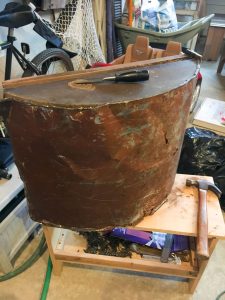
Locate an element on the screen. Image resolution: width=225 pixels, height=300 pixels. table is located at coordinates (214, 30).